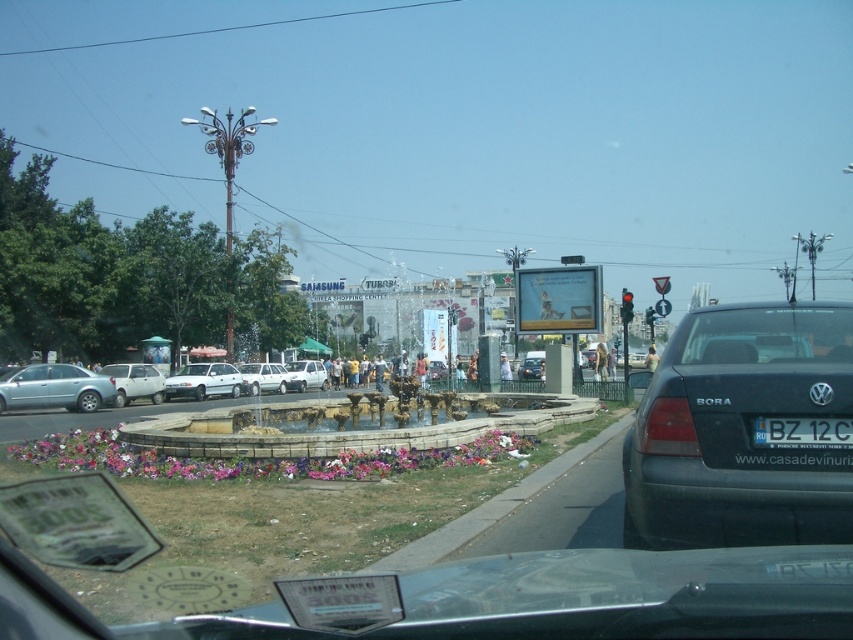
Question: Is black matte car at right wider than silver metallic sedan at left?

Choices:
 (A) no
 (B) yes

Answer: (A)

Question: Does white matte sedan at center have a smaller size compared to white matte car at center?

Choices:
 (A) no
 (B) yes

Answer: (B)

Question: Considering the real-world distances, which object is farthest from the white matte van at center?

Choices:
 (A) satin black sedan at center
 (B) white matte suv at left
 (C) white matte sedan at center

Answer: (B)

Question: Which is nearer to the satin black sedan at center?

Choices:
 (A) black matte car at right
 (B) white matte car at center

Answer: (B)

Question: Which of the following is the closest to the observer?

Choices:
 (A) (148, 368)
 (B) (184, 385)
 (C) (666, 464)
 (D) (815, 420)

Answer: (D)

Question: Can you confirm if black matte car at right is positioned above silver metallic sedan at left?

Choices:
 (A) no
 (B) yes

Answer: (B)